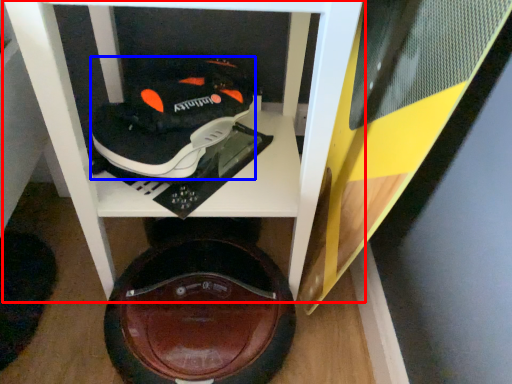
Question: Which point is further to the camera, furniture (highlighted by a red box) or shoe (highlighted by a blue box)?

Choices:
 (A) furniture
 (B) shoe

Answer: (B)